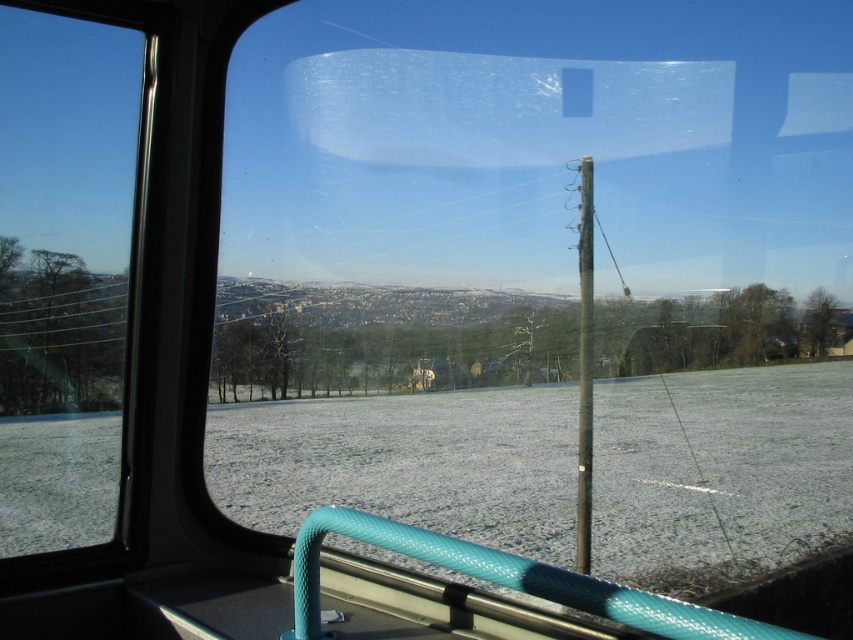
Can you confirm if transparent glass window at left is positioned to the left of metallic pole at center?

Yes, transparent glass window at left is to the left of metallic pole at center.

Identify the location of transparent glass window at left. The height and width of the screenshot is (640, 853). (62, 273).

Locate an element on the screen. The image size is (853, 640). transparent glass window at left is located at coordinates (62, 273).